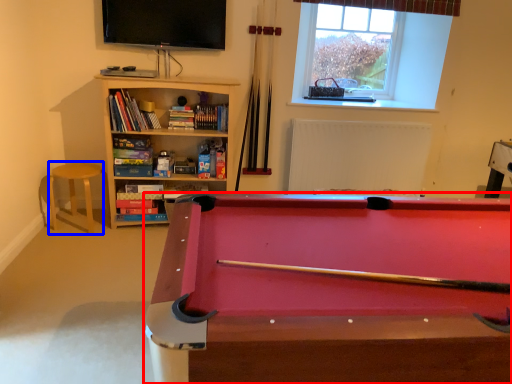
Question: Which object appears farthest to the camera in this image, billiard table (highlighted by a red box) or bar stool (highlighted by a blue box)?

Choices:
 (A) billiard table
 (B) bar stool

Answer: (B)